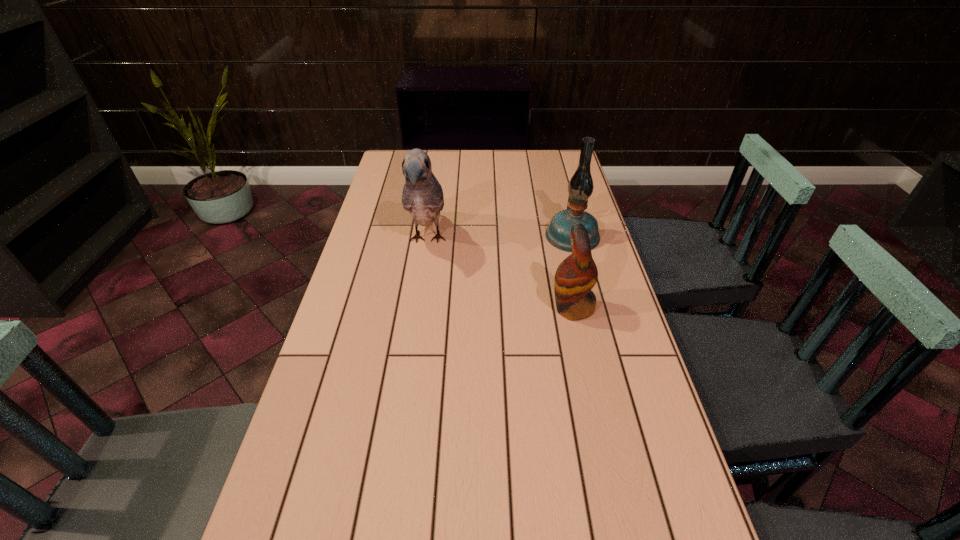
Locate an element on the screen. object at the left edge is located at coordinates (422, 196).

Identify the location of oil lamp situated at the right edge. This screenshot has height=540, width=960. (580, 187).

Locate an element on the screen. parrot that is at the right edge is located at coordinates (576, 275).

I want to click on free space at the far edge of the desktop, so click(x=474, y=150).

Find the location of a particular element. vacant space at the left edge of the desktop is located at coordinates (404, 221).

In the image, there is a desktop. At what (x,y) coordinates should I click in order to perform the action: click on vacant area at the right edge. Please return your answer as a coordinate pair (x, y). This screenshot has height=540, width=960. Looking at the image, I should click on point(645,415).

Identify the location of free region at the far left corner of the desktop. The height and width of the screenshot is (540, 960). click(393, 164).

Image resolution: width=960 pixels, height=540 pixels. I want to click on free space at the far right corner, so click(x=571, y=172).

Find the location of a particular element. vacant area that lies between the farther parrot and the nearest object is located at coordinates (500, 274).

I want to click on blank region between the farther parrot and the shortest object, so click(500, 274).